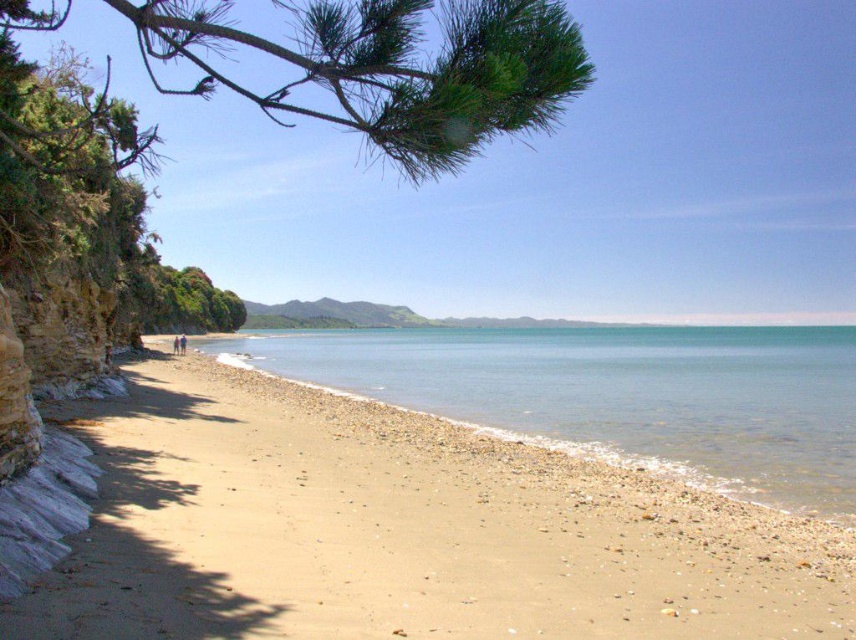
Question: Can you confirm if light brown gravel at lower left is smaller than clear blue water at center?

Choices:
 (A) yes
 (B) no

Answer: (A)

Question: Is light brown gravel at lower left behind clear blue water at center?

Choices:
 (A) yes
 (B) no

Answer: (B)

Question: Among these objects, which one is nearest to the camera?

Choices:
 (A) clear blue water at center
 (B) blue fabric person at lower left

Answer: (A)

Question: Which is nearer to the blue t-shirt at lower left?

Choices:
 (A) blue fabric person at lower left
 (B) green needle-like leaves at upper left
 (C) light brown gravel at lower left
 (D) clear blue water at center

Answer: (A)

Question: Does clear blue water at center have a lesser width compared to blue fabric person at lower left?

Choices:
 (A) yes
 (B) no

Answer: (B)

Question: Among these objects, which one is nearest to the camera?

Choices:
 (A) blue fabric person at lower left
 (B) green needle-like leaves at upper left
 (C) light brown gravel at lower left

Answer: (B)